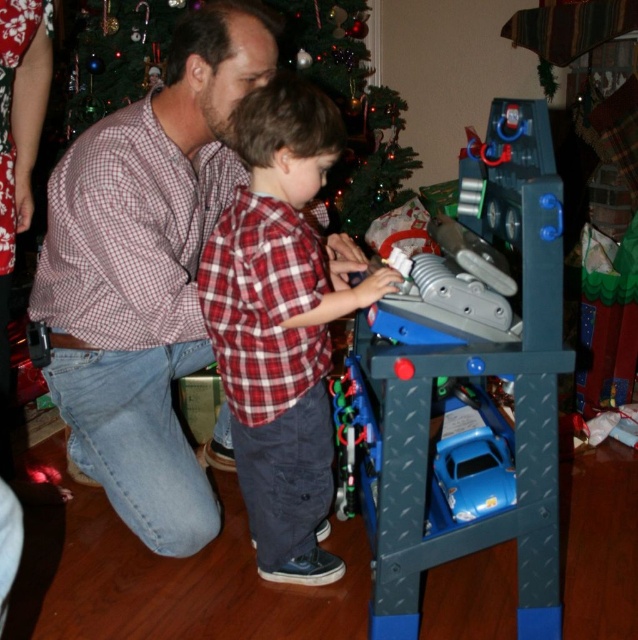
Question: Can you confirm if blue plastic toy at center is positioned to the left of red plaid shirt at center?

Choices:
 (A) yes
 (B) no

Answer: (B)

Question: Observing the image, what is the correct spatial positioning of checkered shirt at center in reference to red plaid shirt at center?

Choices:
 (A) above
 (B) below

Answer: (A)

Question: Among these points, which one is nearest to the camera?

Choices:
 (A) (115, 26)
 (B) (461, 346)
 (C) (263, 547)

Answer: (B)

Question: Which object is the farthest from the blue plastic car at lower center?

Choices:
 (A) red plaid shirt at center
 (B) checkered shirt at center

Answer: (B)

Question: Which point is farther to the camera?

Choices:
 (A) blue plastic toy at center
 (B) green matte christmas tree at upper center

Answer: (B)

Question: Is checkered shirt at center thinner than blue plastic car at lower center?

Choices:
 (A) no
 (B) yes

Answer: (A)